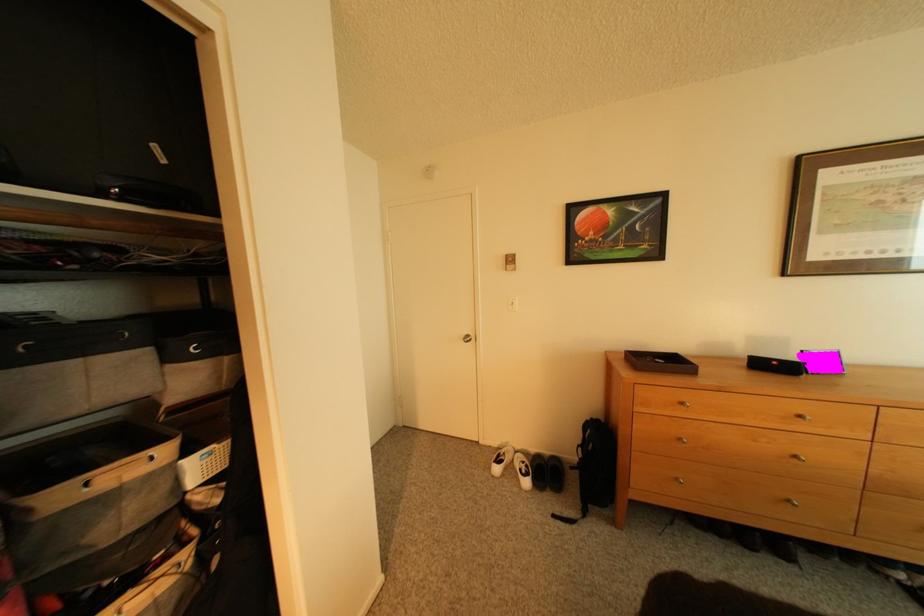
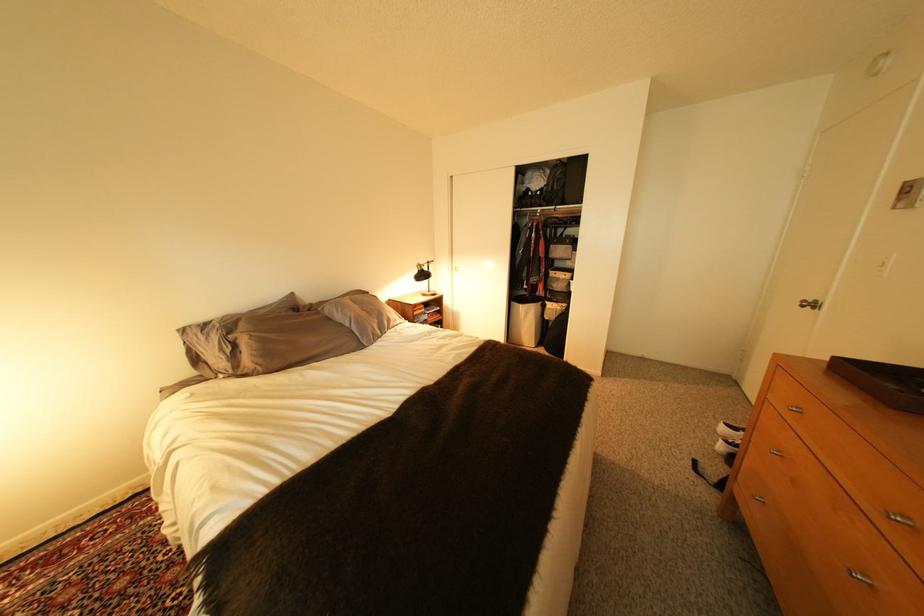
Where in the second image is the point corresponding to the point at 540,485 from the first image?

(734, 448)